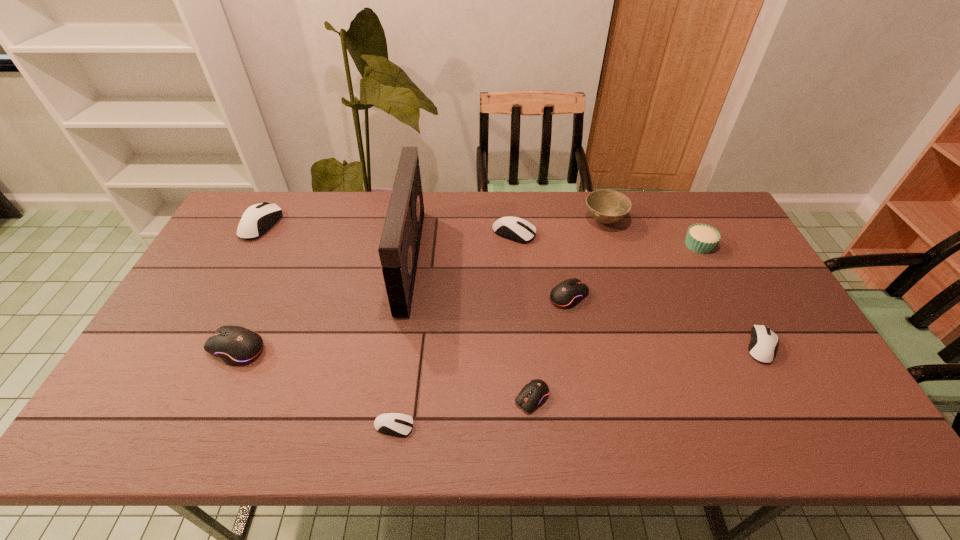
The width and height of the screenshot is (960, 540). In order to click on black videotape in this screenshot , I will do 399,245.

The height and width of the screenshot is (540, 960). I want to click on the tallest object, so coord(399,245).

This screenshot has height=540, width=960. In order to click on gray bowl in this screenshot , I will do `click(606, 206)`.

I want to click on the eighth object from left to right, so pyautogui.click(x=606, y=206).

Identify the location of the leftmost white mouse. The image size is (960, 540). (257, 219).

Where is `the leftmost black computer mouse`? the leftmost black computer mouse is located at coordinates (235, 345).

Identify the location of the second nearest black computer mouse. (235, 345).

Where is `cupcake`? This screenshot has height=540, width=960. cupcake is located at coordinates (701, 238).

Find the location of `the second white mouse from right to left`. the second white mouse from right to left is located at coordinates (520, 230).

Image resolution: width=960 pixels, height=540 pixels. I want to click on the sixth mouse from left to right, so click(567, 294).